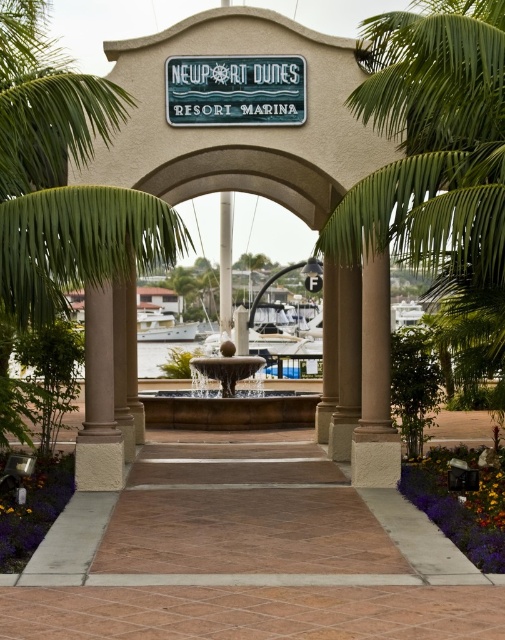
Is beige stone pillar at center thinner than white glossy boat at center?

Yes, beige stone pillar at center is thinner than white glossy boat at center.

Is beige stone pillar at center further to camera compared to white glossy boat at center?

No, beige stone pillar at center is in front of white glossy boat at center.

Between point (223, 285) and point (143, 340), which one is positioned in front?

Point (223, 285) is in front.

Locate an element on the screen. This screenshot has width=505, height=640. beige stone pillar at center is located at coordinates (226, 262).

Measure the distance between smooth stone fountain at center and beige stone pillar at center.

6.24 meters

Which is in front, point (171, 408) or point (230, 220)?

Point (171, 408) is in front.

Where is `smooth stone fountain at center`? smooth stone fountain at center is located at coordinates (236, 397).

Does point (371, 294) come farther from viewer compared to point (118, 470)?

Yes, it is.

Is beige stucco column at center below brown stone pillar at center?

No.

Does point (379, 282) lie behind point (108, 490)?

Yes, point (379, 282) is behind point (108, 490).

Locate an element on the screen. The width and height of the screenshot is (505, 640). beige stucco column at center is located at coordinates (376, 380).